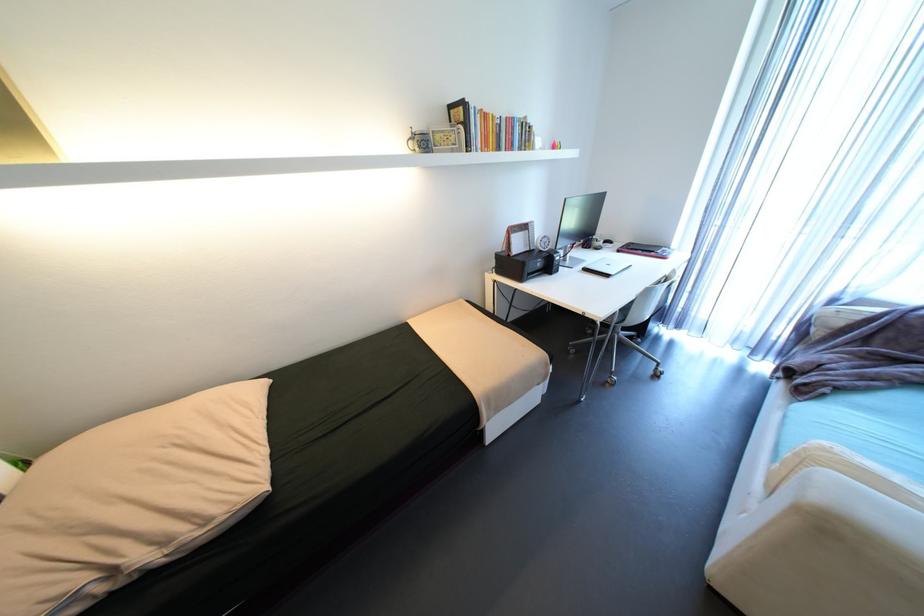
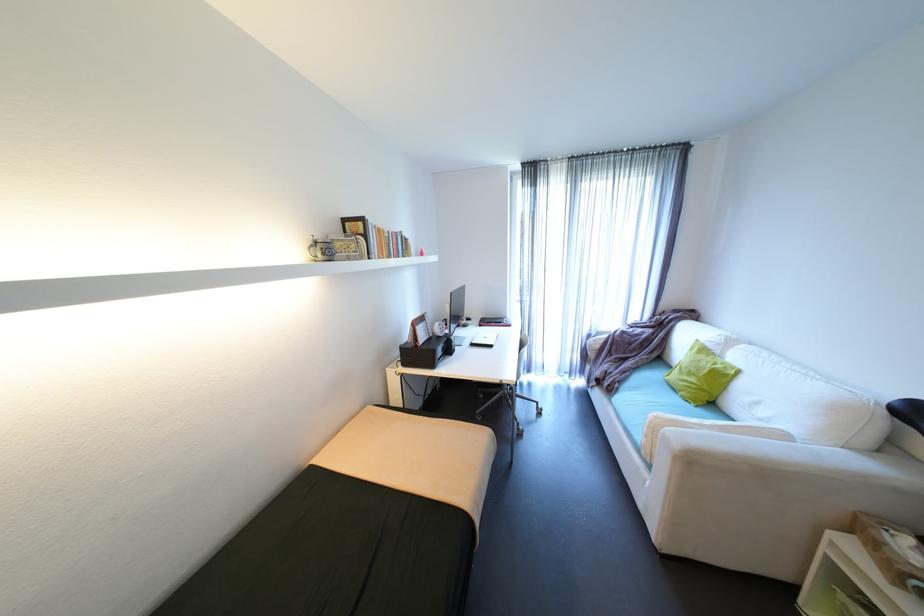
Find the pixel in the second image that matches the point at 573,199 in the first image.

(458, 294)